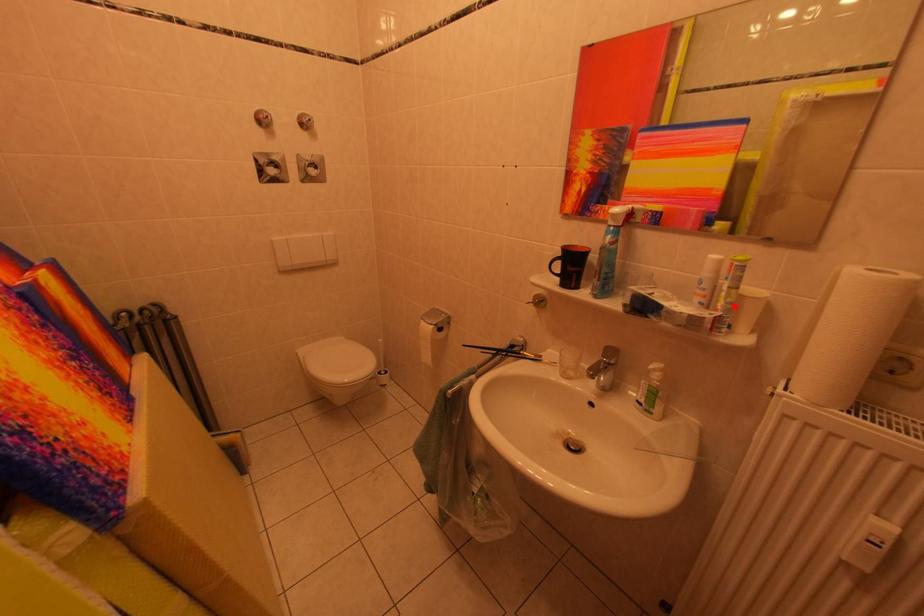
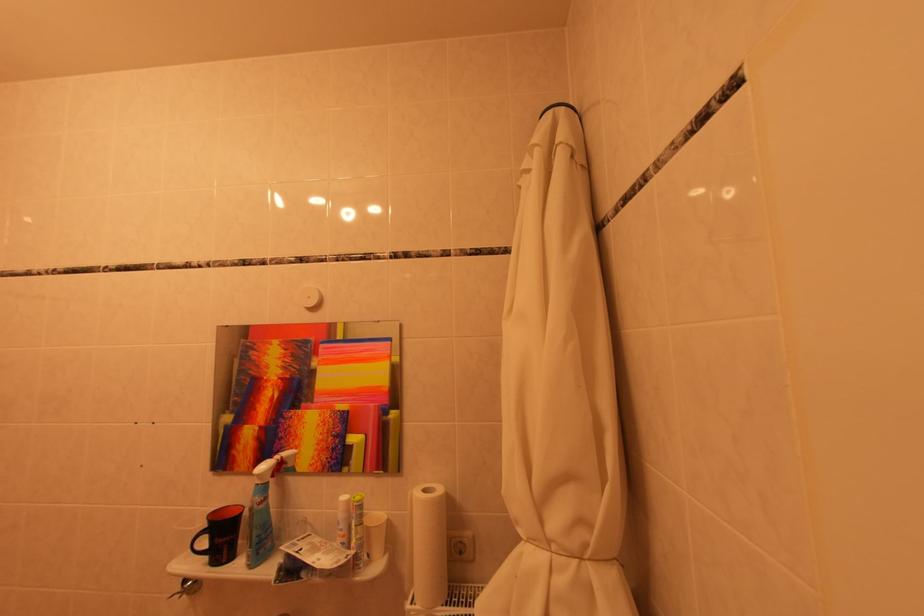
Where in the second image is the point corresponding to the highlighted location from the first image?

(365, 544)